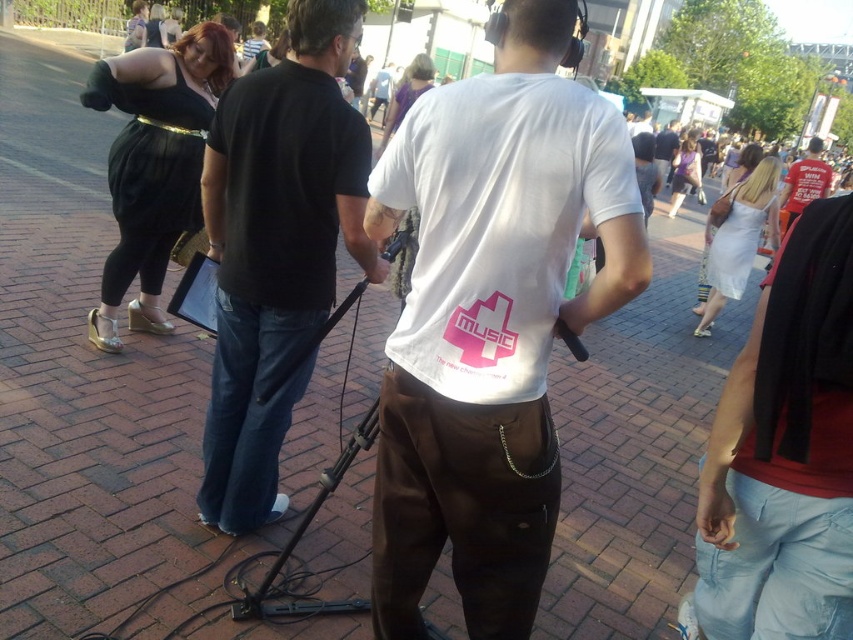
Does black satin dress at upper left appear on the right side of white cotton t-shirt at center?

In fact, black satin dress at upper left is to the left of white cotton t-shirt at center.

How far apart are black satin dress at upper left and white cotton t-shirt at center?

black satin dress at upper left is 19.41 feet away from white cotton t-shirt at center.

You are a GUI agent. You are given a task and a screenshot of the screen. Output one action in this format:
    pyautogui.click(x=<x>, y=<y>)
    Task: Click on the black satin dress at upper left
    This screenshot has width=853, height=640.
    Given the screenshot: What is the action you would take?
    pyautogui.click(x=154, y=164)

Does point (219, 160) come farther from viewer compared to point (784, 227)?

No, (219, 160) is in front of (784, 227).

Between point (303, 60) and point (782, 196), which one is positioned in front?

Point (303, 60) is more forward.

What do you see at coordinates (277, 248) in the screenshot? Image resolution: width=853 pixels, height=640 pixels. I see `black cotton t-shirt at center` at bounding box center [277, 248].

You are a GUI agent. You are given a task and a screenshot of the screen. Output one action in this format:
    pyautogui.click(x=<x>, y=<y>)
    Task: Click on the black cotton t-shirt at center
    
    Given the screenshot: What is the action you would take?
    pyautogui.click(x=277, y=248)

Who is more forward, (x=276, y=330) or (x=756, y=220)?

Positioned in front is point (x=276, y=330).

Measure the distance between black cotton t-shirt at center and white satin dress at upper right.

black cotton t-shirt at center and white satin dress at upper right are 4.98 meters apart from each other.

Is point (247, 128) less distant than point (752, 172)?

Yes, point (247, 128) is in front of point (752, 172).

In order to click on black cotton t-shirt at center in this screenshot , I will do `click(277, 248)`.